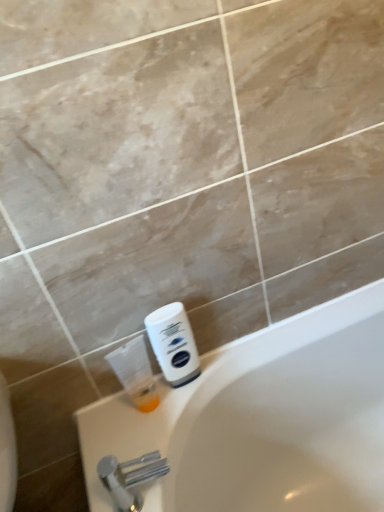
Question: Is silver metallic faucet at lower left smaller than white matte shaving cream at lower right?

Choices:
 (A) yes
 (B) no

Answer: (B)

Question: Considering the relative positions of silver metallic faucet at lower left and white matte shaving cream at lower right in the image provided, is silver metallic faucet at lower left to the left of white matte shaving cream at lower right from the viewer's perspective?

Choices:
 (A) yes
 (B) no

Answer: (A)

Question: Is silver metallic faucet at lower left facing away from white matte shaving cream at lower right?

Choices:
 (A) yes
 (B) no

Answer: (B)

Question: From a real-world perspective, is silver metallic faucet at lower left located beneath white matte shaving cream at lower right?

Choices:
 (A) yes
 (B) no

Answer: (A)

Question: Is the surface of silver metallic faucet at lower left in direct contact with white matte shaving cream at lower right?

Choices:
 (A) no
 (B) yes

Answer: (A)

Question: Is white matte shaving cream at lower right in front of or behind translucent plastic bottle at lower left in the image?

Choices:
 (A) behind
 (B) front

Answer: (A)

Question: From the image's perspective, relative to translucent plastic bottle at lower left, is white matte shaving cream at lower right above or below?

Choices:
 (A) above
 (B) below

Answer: (A)

Question: Considering the positions of point (185, 320) and point (140, 334), is point (185, 320) closer or farther from the camera than point (140, 334)?

Choices:
 (A) closer
 (B) farther

Answer: (B)

Question: From a real-world perspective, is white matte shaving cream at lower right physically located above or below translucent plastic bottle at lower left?

Choices:
 (A) below
 (B) above

Answer: (B)

Question: Visually, is translucent plastic bottle at lower left positioned to the left or to the right of white matte shaving cream at lower right?

Choices:
 (A) left
 (B) right

Answer: (A)

Question: Is translucent plastic bottle at lower left taller or shorter than white matte shaving cream at lower right?

Choices:
 (A) tall
 (B) short

Answer: (B)

Question: Is point (135, 362) closer or farther from the camera than point (183, 342)?

Choices:
 (A) closer
 (B) farther

Answer: (B)

Question: From the image's perspective, relative to white matte shaving cream at lower right, is translucent plastic bottle at lower left above or below?

Choices:
 (A) below
 (B) above

Answer: (A)

Question: Visually, is white matte shaving cream at lower right positioned to the left or to the right of silver metallic faucet at lower left?

Choices:
 (A) left
 (B) right

Answer: (B)

Question: Is white matte shaving cream at lower right taller or shorter than silver metallic faucet at lower left?

Choices:
 (A) short
 (B) tall

Answer: (B)